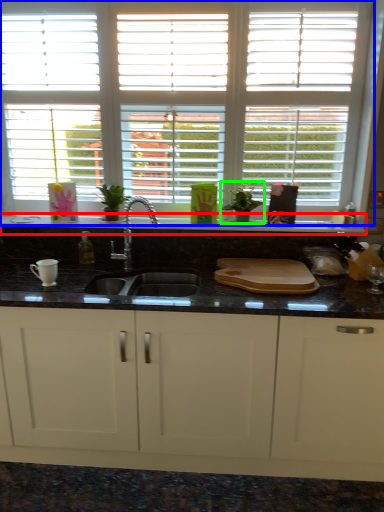
Question: Based on their relative distances, which object is farther from counter top (highlighted by a red box)? Choose from window (highlighted by a blue box) and plant (highlighted by a green box).

Choices:
 (A) window
 (B) plant

Answer: (A)